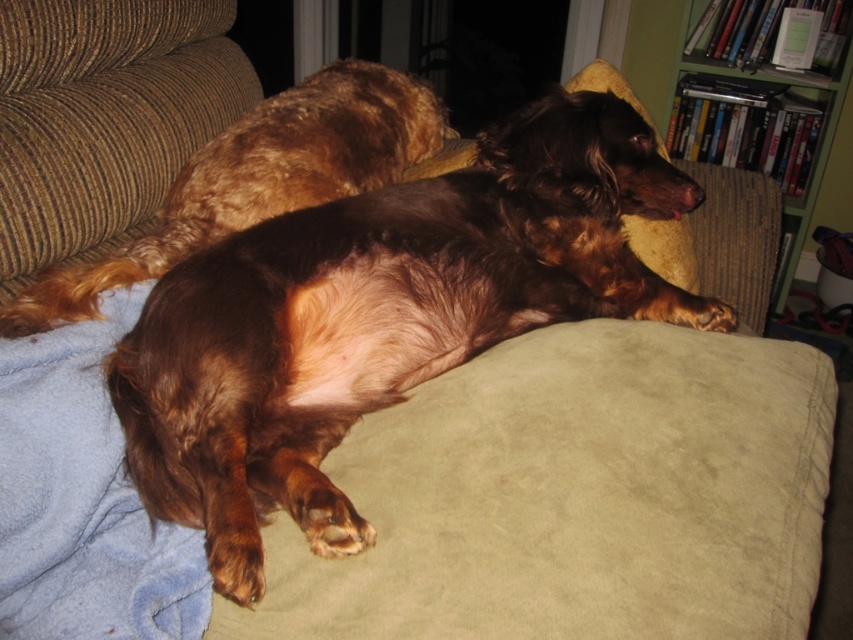
You are a person sitting on the couch and want to grab the blue fleece blanket at lower left. Can you reach it without moving your body? The couch you are sitting on is 24 inches wide.

The blue fleece blanket at lower left is 28.28 inches away from you, which is slightly farther than the couch width of 24 inches. You might need to stretch a bit, but it should be reachable without moving your body.

You are a photographer setting up a shoot in the living room where the two dogs are resting. You want to place a small stool to the right of the blue fleece blanket at lower left so that it doesn your setup. Will the shiny brown fur at center be to the left or right of the stool once placed?

The blue fleece blanket at lower left is to the left of the shiny brown fur at center. Placing the stool to the right of the blue fleece blanket at lower left would position it between the blanket and the shiny brown fur at center. Therefore, the shiny brown fur at center will be to the right of the stool.

You are trying to place a new toy for the brown shaggy dog at center. The blue fleece blanket at lower left is currently in the way. Can you move the toy to the left side of the blanket without moving the dog?

The brown shaggy dog at center is to the right of the blue fleece blanket at lower left, so moving the toy to the left side of the blanket would place it further away from the dog. This might not be ideal since the dog is positioned to the right of the blanket.